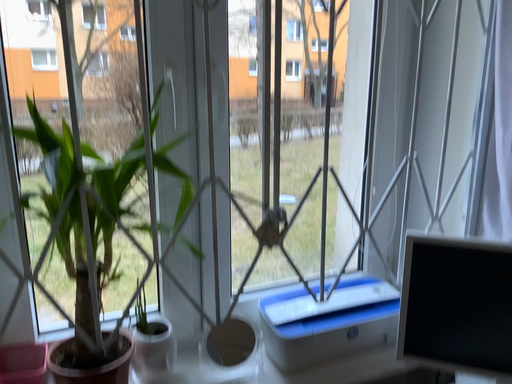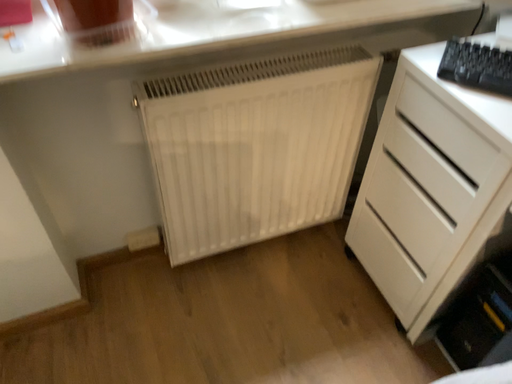
Question: Which way did the camera rotate in the video?

Choices:
 (A) rotated upward
 (B) rotated downward

Answer: (B)